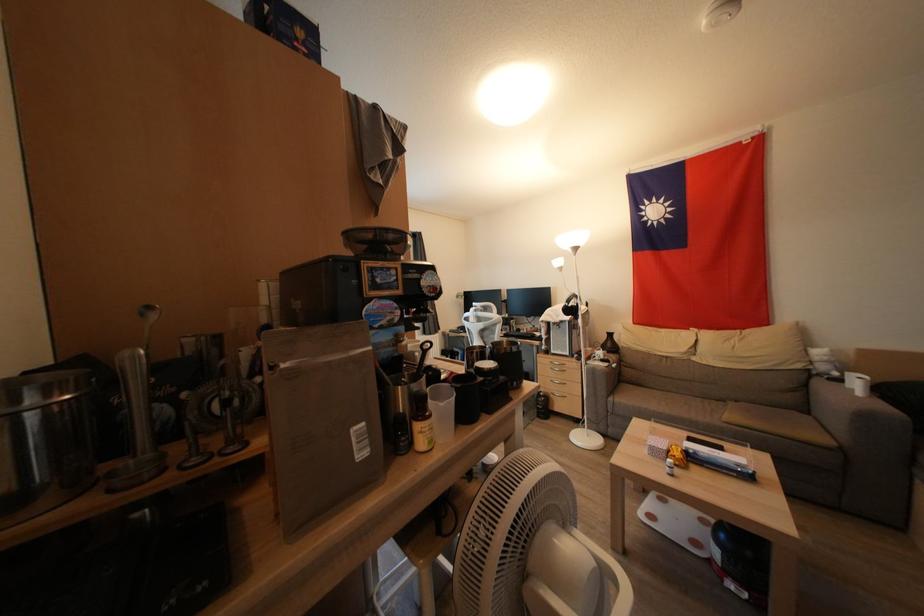
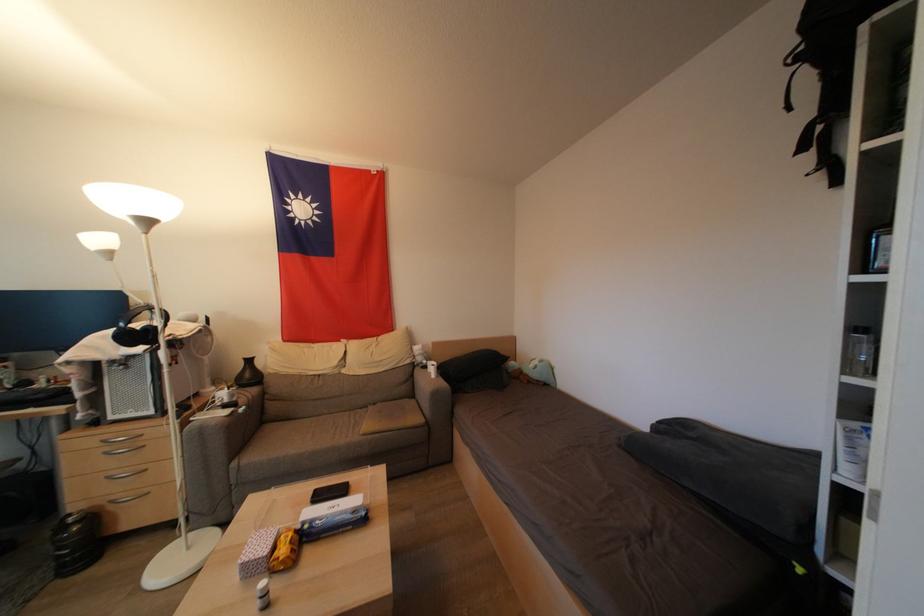
Where in the second image is the point corresponding to the point at 552,400 from the first image?

(99, 521)